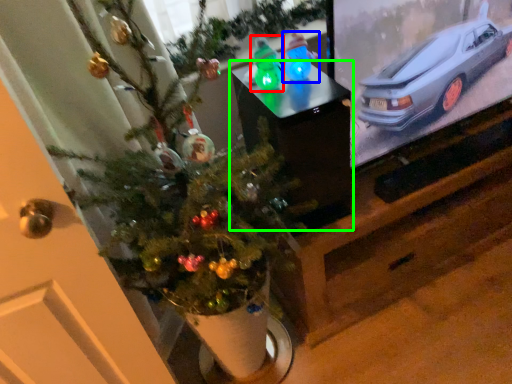
Question: Estimate the real-world distances between objects in this image. Which object is farther from toy (highlighted by a red box), toy (highlighted by a blue box) or furniture (highlighted by a green box)?

Choices:
 (A) toy
 (B) furniture

Answer: (B)